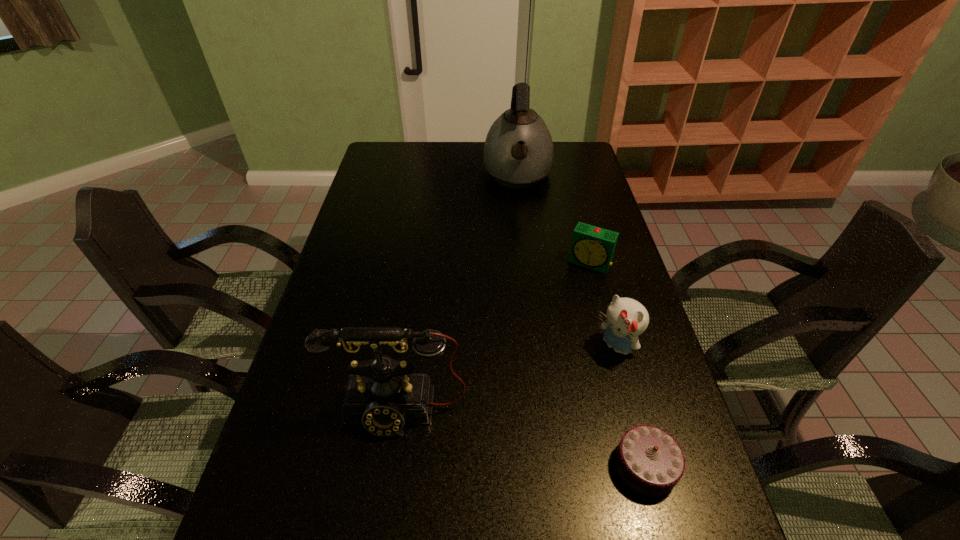
Locate an element on the screen. This screenshot has width=960, height=540. free space on the desktop that is between the leftmost object and the chocolate cake and is positioned on the front-facing side of the third nearest object is located at coordinates (521, 438).

This screenshot has height=540, width=960. In order to click on vacant space on the desktop that is between the leftmost object and the chocolate cake and is positioned on the front-facing side of the alarm clock in this screenshot , I will do `click(506, 435)`.

Find the location of `free spot on the desktop that is between the fourth shortest object and the chocolate cake and is positioned at the spout of the farthest object`. free spot on the desktop that is between the fourth shortest object and the chocolate cake and is positioned at the spout of the farthest object is located at coordinates (518, 437).